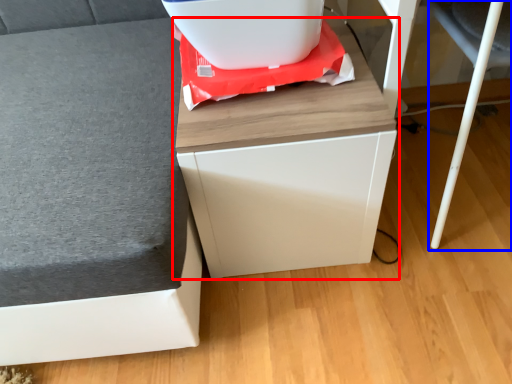
Question: Which object appears closest to the camera in this image, furniture (highlighted by a red box) or swivel chair (highlighted by a blue box)?

Choices:
 (A) furniture
 (B) swivel chair

Answer: (B)